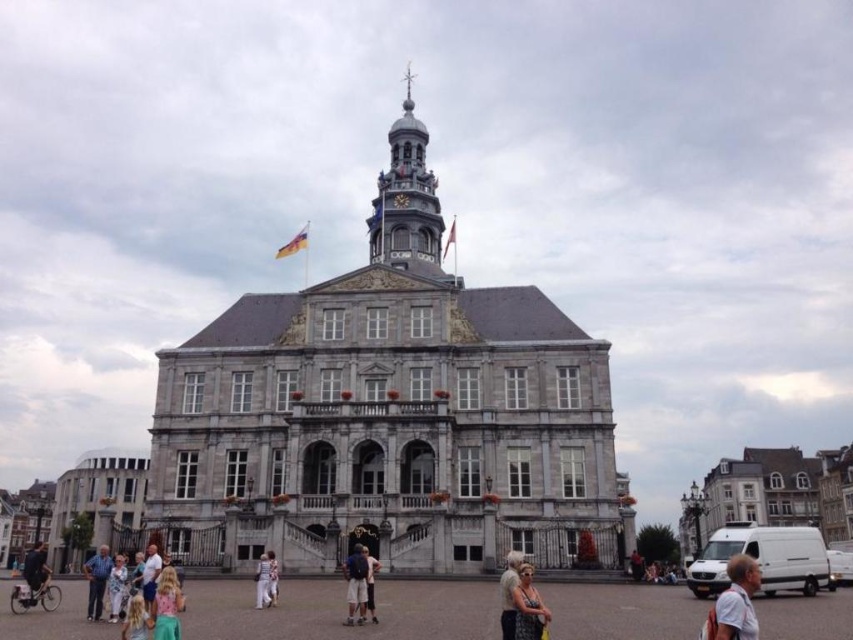
You are standing in the city square in front of the historic building. You notice a white cotton shirt at lower right and dark blue jeans at lower left. Which clothing item is positioned higher relative to the other?

The white cotton shirt at lower right is located above the dark blue jeans at lower left.

You are standing in the city square and see the historic building with its grand entrance. You notice a white cotton shirt at lower right and a white cotton dress at center. Which clothing item is closer to the entrance of the building?

The white cotton shirt at lower right is positioned over the white cotton dress at center, meaning it is closer to the entrance of the building.